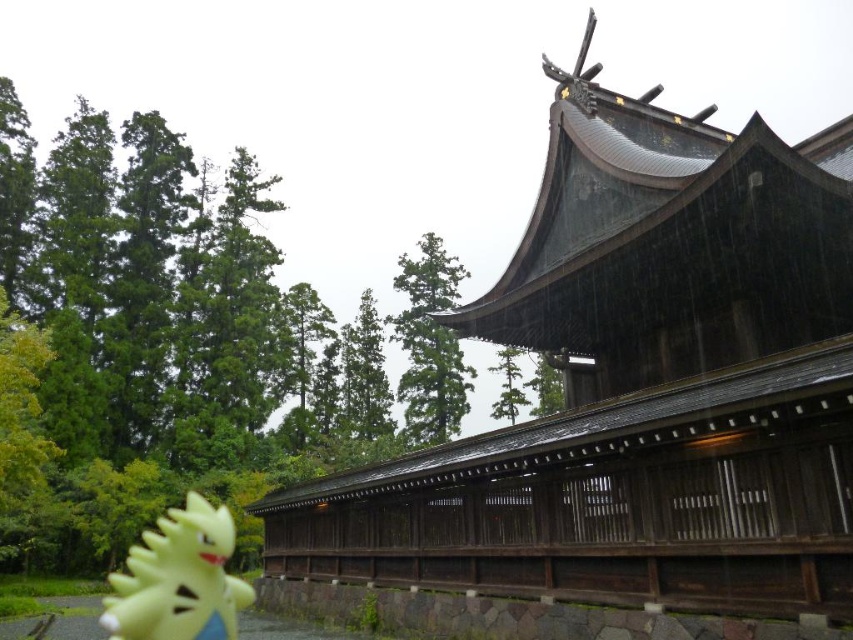
Is shiny dark wood temple at upper center closer to the viewer compared to yellow rubber toy at lower left?

That is False.

At what (x,y) coordinates should I click in order to perform the action: click on shiny dark wood temple at upper center. Please return your answer as a coordinate pair (x, y). Looking at the image, I should click on (635, 387).

In order to click on shiny dark wood temple at upper center in this screenshot , I will do `click(635, 387)`.